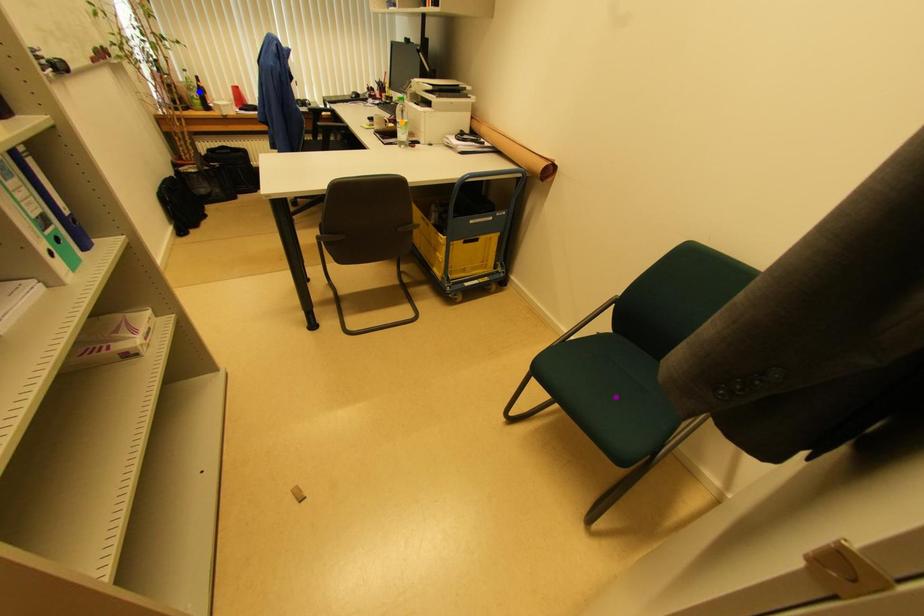
Order these from nearest to farthest:
1. blue point
2. orange point
3. purple point

1. purple point
2. orange point
3. blue point